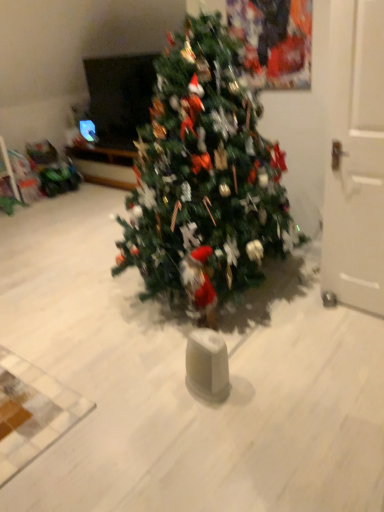
Identify the location of vacant space situated on the left part of green matte christmas tree at center. This screenshot has width=384, height=512. (65, 304).